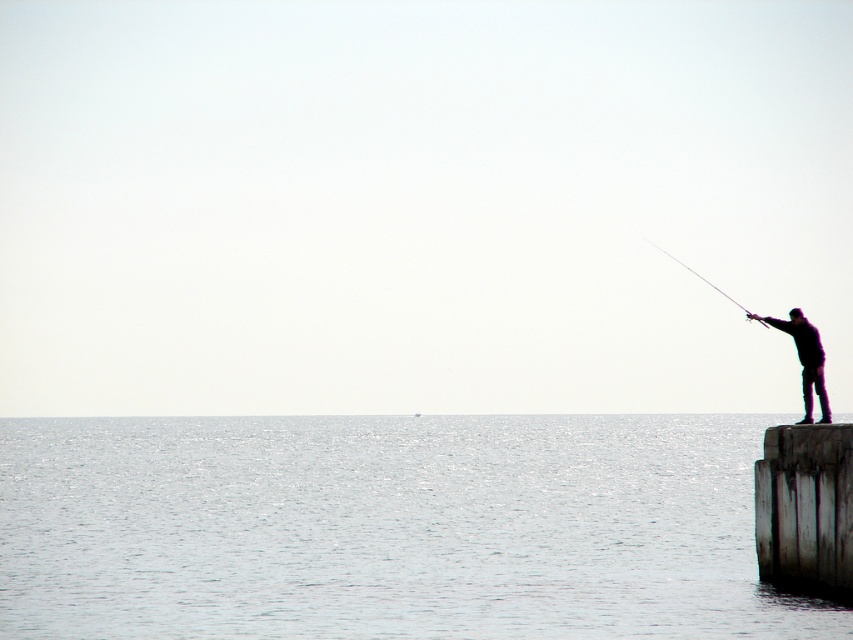
Between weathered wood dock at right and smooth black rod at right, which one has more height?

With more height is smooth black rod at right.

Consider the image. Is weathered wood dock at right below smooth black rod at right?

Correct, weathered wood dock at right is located below smooth black rod at right.

Locate an element on the screen. weathered wood dock at right is located at coordinates (805, 506).

Can you confirm if shiny blue water at lower left is shorter than weathered wood dock at right?

In fact, shiny blue water at lower left may be taller than weathered wood dock at right.

Between point (32, 440) and point (782, 545), which one is positioned in front?

Positioned in front is point (782, 545).

This screenshot has height=640, width=853. In order to click on shiny blue water at lower left in this screenshot , I will do `click(387, 529)`.

Find the location of a particular element. This screenshot has height=640, width=853. shiny blue water at lower left is located at coordinates (387, 529).

Is shiny blue water at lower left shorter than dark matte clothing at right?

No.

Find the location of a particular element. This screenshot has height=640, width=853. shiny blue water at lower left is located at coordinates (387, 529).

Is point (480, 634) positioned before point (805, 330)?

Yes, point (480, 634) is in front of point (805, 330).

Image resolution: width=853 pixels, height=640 pixels. In order to click on shiny blue water at lower left in this screenshot , I will do `click(387, 529)`.